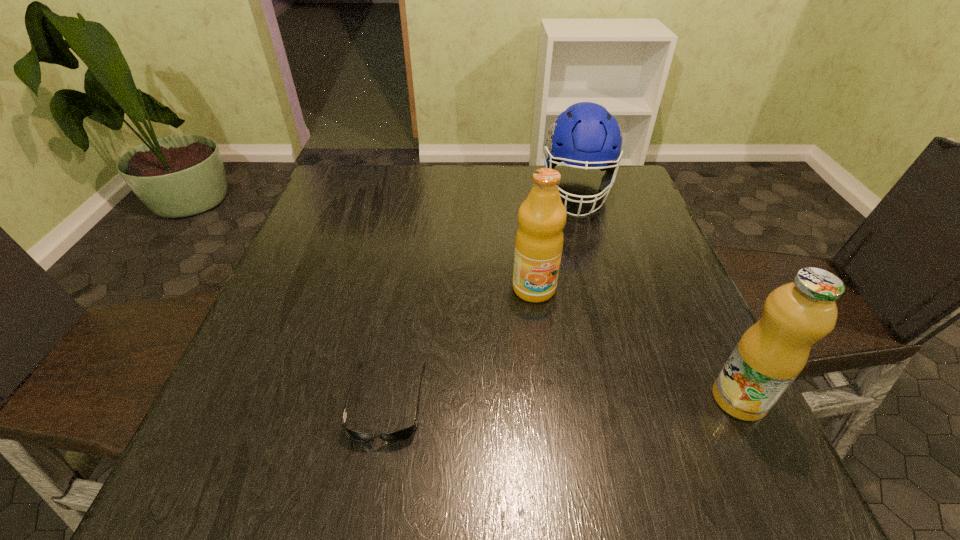
Where is `object that is at the near right corner`? This screenshot has width=960, height=540. object that is at the near right corner is located at coordinates (769, 356).

Identify the location of free spot at the far edge of the desktop. coord(408,192).

In the image, there is a desktop. At what (x,y) coordinates should I click in order to perform the action: click on vacant space at the near edge. Please return your answer as a coordinate pair (x, y). Looking at the image, I should click on (492, 399).

In order to click on vacant area at the left edge of the desktop in this screenshot , I will do `click(333, 249)`.

Locate an element on the screen. The width and height of the screenshot is (960, 540). vacant area at the right edge of the desktop is located at coordinates (696, 316).

At what (x,y) coordinates should I click in order to perform the action: click on free space at the far left corner of the desktop. Please return your answer as a coordinate pair (x, y). Image resolution: width=960 pixels, height=540 pixels. Looking at the image, I should click on (314, 206).

At what (x,y) coordinates should I click in order to perform the action: click on blank area at the far right corner. Please return your answer as a coordinate pair (x, y). This screenshot has width=960, height=540. Looking at the image, I should click on (591, 180).

The width and height of the screenshot is (960, 540). I want to click on vacant space that is in between the rightmost object and the sunglasses, so coord(563,400).

At what (x,y) coordinates should I click in order to perform the action: click on blank region between the rightmost object and the left fruit juice. Please return your answer as a coordinate pair (x, y). The height and width of the screenshot is (540, 960). Looking at the image, I should click on [636, 343].

Where is `free spot between the second object from right to left and the right fruit juice`? The image size is (960, 540). free spot between the second object from right to left and the right fruit juice is located at coordinates (658, 296).